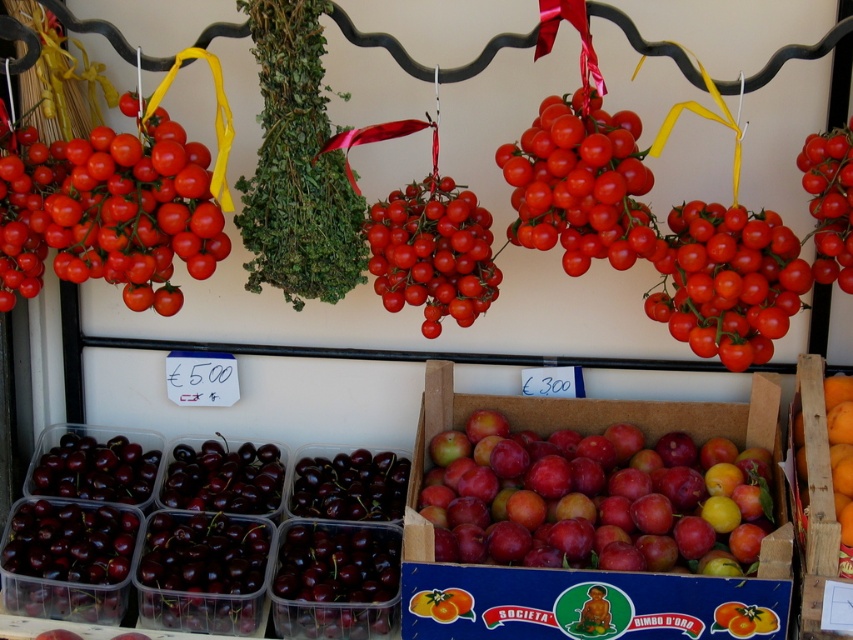
Between glossy red tomato at left and shiny cardboard box of plums at center, which one appears on the left side from the viewer's perspective?

glossy red tomato at left

Who is more forward, (138,257) or (424,528)?

Point (138,257) is in front.

Is point (28, 232) closer to camera compared to point (439, 564)?

That is True.

Find the location of a particular element. This screenshot has width=853, height=640. glossy red tomato at left is located at coordinates (109, 212).

Who is positioned more to the left, shiny cardboard box of plums at center or glossy cherry tomatoes at upper right?

From the viewer's perspective, shiny cardboard box of plums at center appears more on the left side.

Which is more to the right, shiny cardboard box of plums at center or glossy cherry tomatoes at upper right?

From the viewer's perspective, glossy cherry tomatoes at upper right appears more on the right side.

Is point (675, 413) less distant than point (837, 156)?

No, it is not.

The image size is (853, 640). Identify the location of shiny cardboard box of plums at center. (572, 428).

I want to click on glossy red cherry at center, so click(x=432, y=252).

How far apart are glossy red cherry at center and dark purple glossy cherries at center?

glossy red cherry at center is 22.29 inches away from dark purple glossy cherries at center.

Between point (410, 248) and point (338, 481), which one is positioned in front?

Point (410, 248) is in front.

The image size is (853, 640). What are the coordinates of `glossy red cherry at center` in the screenshot? It's located at click(432, 252).